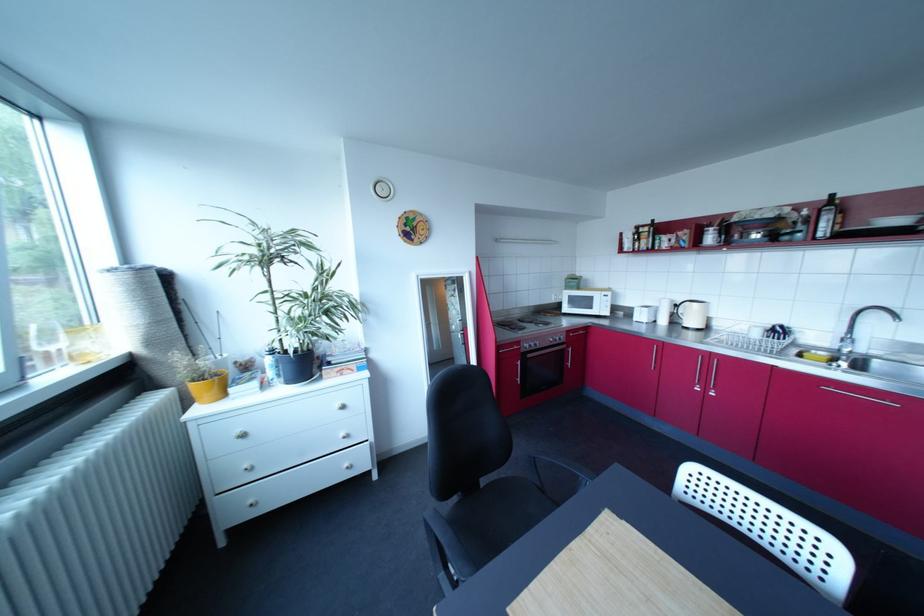
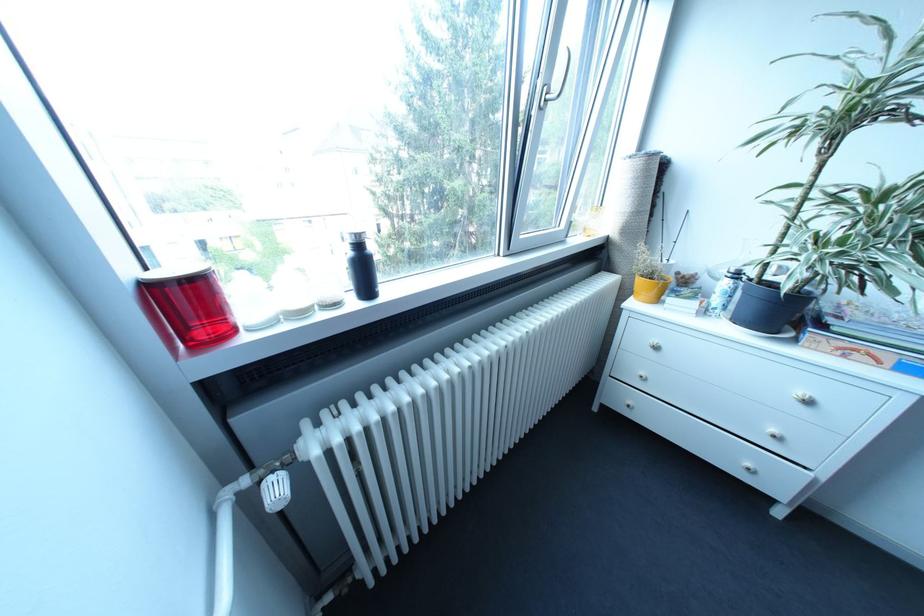
Based on the continuous images, in which direction is the camera rotating?

The camera's rotation is toward left-down.